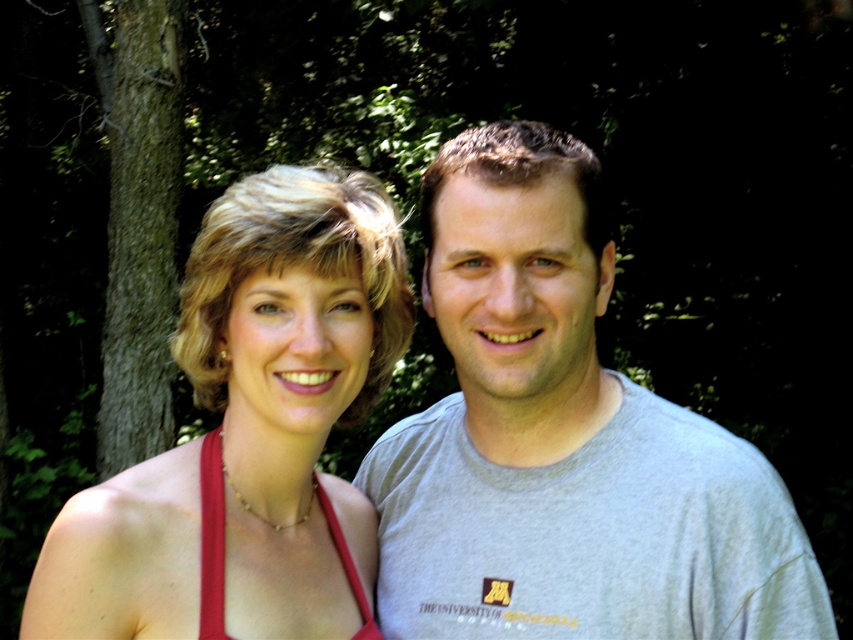
Question: Is gray cotton t-shirt at center below matte red dress at center?

Choices:
 (A) no
 (B) yes

Answer: (B)

Question: Does gray cotton t-shirt at center have a smaller size compared to matte red dress at center?

Choices:
 (A) no
 (B) yes

Answer: (A)

Question: Which point is closer to the camera taking this photo?

Choices:
 (A) (555, 557)
 (B) (254, 449)

Answer: (B)

Question: Which object appears closest to the camera in this image?

Choices:
 (A) matte red dress at center
 (B) gray cotton t-shirt at center

Answer: (A)

Question: Can you confirm if gray cotton t-shirt at center is wider than matte red dress at center?

Choices:
 (A) yes
 (B) no

Answer: (A)